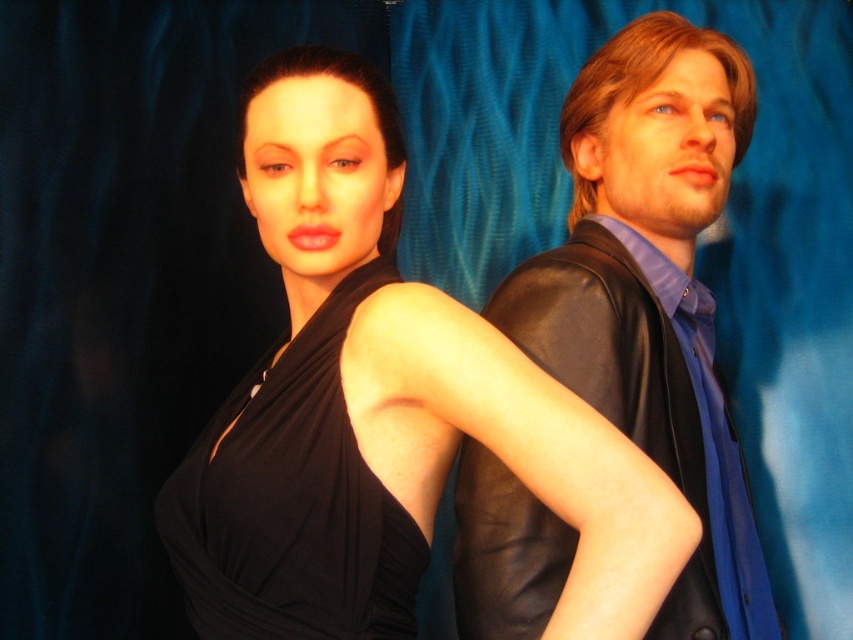
You are a photographer setting up a shoot with two models wearing the leather jacket at right and the black satin dress at upper left. The studio has a limited space, and you need to arrange them so that the larger item is placed first. Which model should you position first?

The leather jacket at right is bigger than the black satin dress at upper left, so you should position the model wearing the leather jacket at right first to accommodate its larger size.